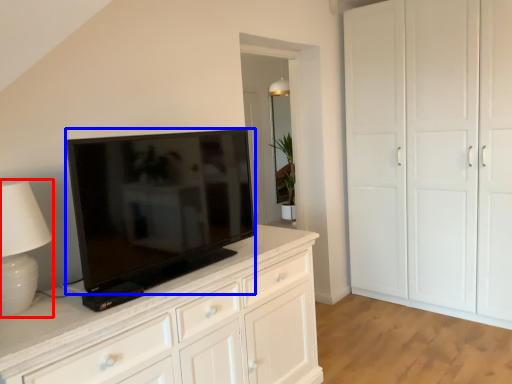
Question: Which of the following is the farthest to the observer, table lamp (highlighted by a red box) or television (highlighted by a blue box)?

Choices:
 (A) table lamp
 (B) television

Answer: (B)